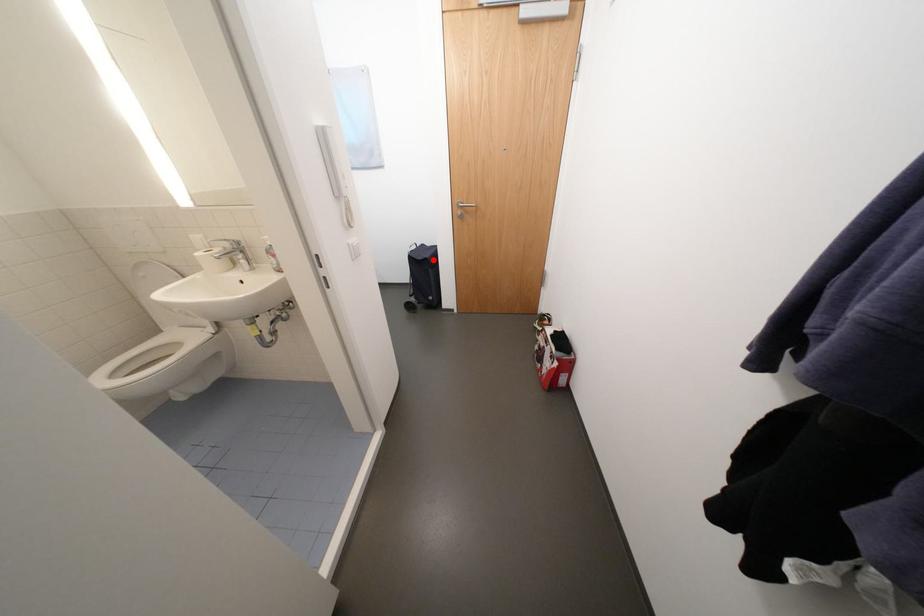
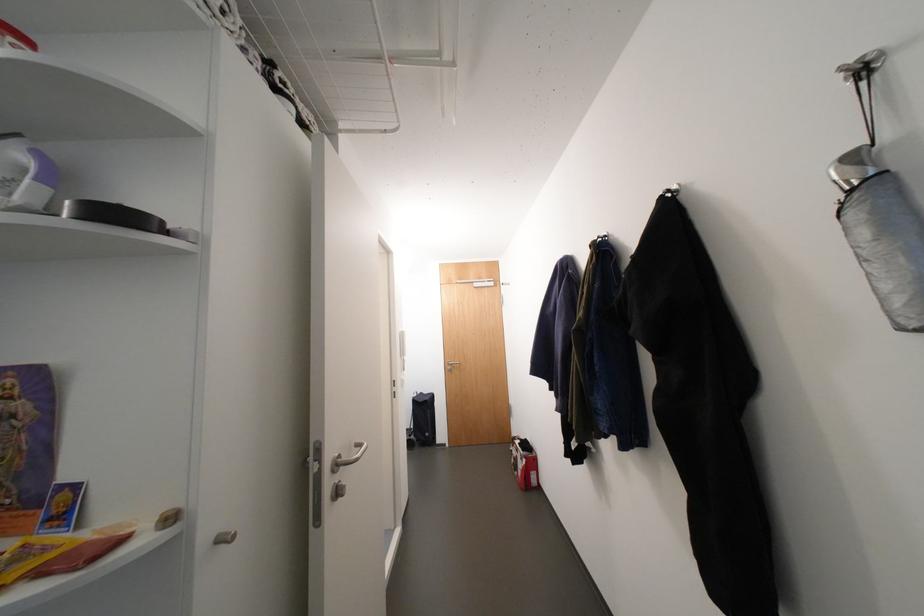
Locate, in the second image, the point that corresponds to the highlighted location in the first image.

(433, 402)